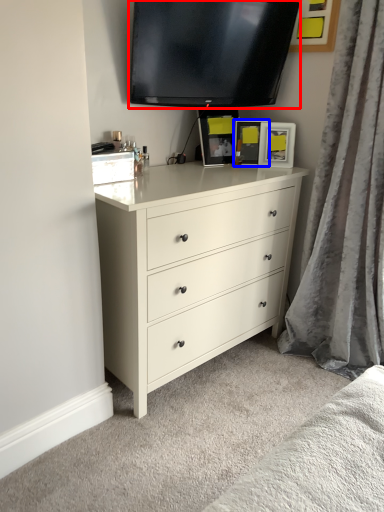
Question: Among these objects, which one is farthest to the camera, television (highlighted by a red box) or picture frame (highlighted by a blue box)?

Choices:
 (A) television
 (B) picture frame

Answer: (B)